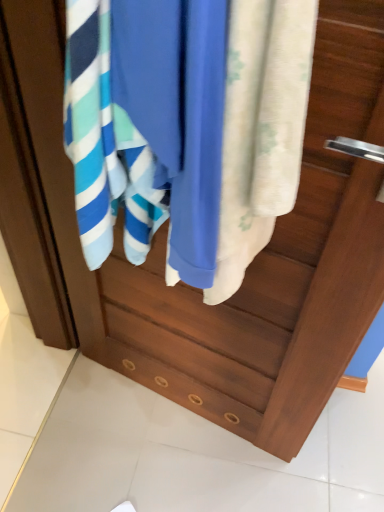
Question: Is blue cotton towel at center positioned beyond the bounds of silky white towel at center?

Choices:
 (A) yes
 (B) no

Answer: (A)

Question: Does blue cotton towel at center have a larger size compared to silky white towel at center?

Choices:
 (A) no
 (B) yes

Answer: (B)

Question: Is blue cotton towel at center taller than silky white towel at center?

Choices:
 (A) yes
 (B) no

Answer: (B)

Question: From a real-world perspective, is blue cotton towel at center on top of silky white towel at center?

Choices:
 (A) yes
 (B) no

Answer: (A)

Question: Is blue cotton towel at center closer to camera compared to silky white towel at center?

Choices:
 (A) no
 (B) yes

Answer: (A)

Question: Is blue cotton towel at center behind silky white towel at center?

Choices:
 (A) no
 (B) yes

Answer: (B)

Question: Is silky white towel at center directly adjacent to blue cotton towel at center?

Choices:
 (A) yes
 (B) no

Answer: (A)

Question: Is silky white towel at center thinner than blue cotton towel at center?

Choices:
 (A) yes
 (B) no

Answer: (A)

Question: From a real-world perspective, is silky white towel at center on top of blue cotton towel at center?

Choices:
 (A) yes
 (B) no

Answer: (B)

Question: Is silky white towel at center closer to the viewer compared to blue cotton towel at center?

Choices:
 (A) no
 (B) yes

Answer: (B)

Question: Considering the relative positions of silky white towel at center and blue cotton towel at center in the image provided, is silky white towel at center to the left of blue cotton towel at center from the viewer's perspective?

Choices:
 (A) no
 (B) yes

Answer: (A)

Question: Does silky white towel at center appear on the right side of blue cotton towel at center?

Choices:
 (A) no
 (B) yes

Answer: (B)

Question: Is silky white towel at center spatially inside blue cotton towel at center, or outside of it?

Choices:
 (A) inside
 (B) outside

Answer: (A)